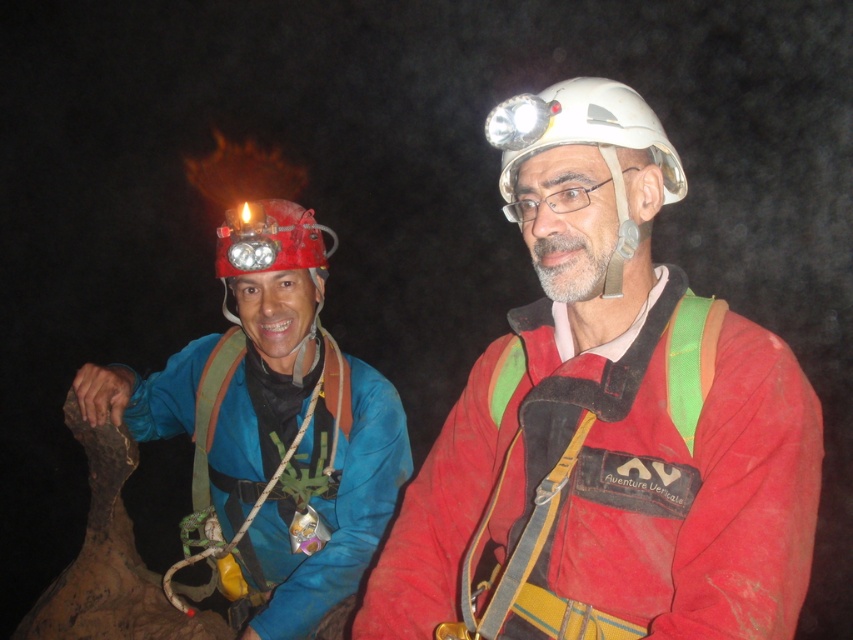
Question: Is matte red jacket at center below matte blue jacket at left?

Choices:
 (A) yes
 (B) no

Answer: (B)

Question: Does matte red jacket at center appear on the right side of matte blue jacket at left?

Choices:
 (A) yes
 (B) no

Answer: (A)

Question: Is matte red jacket at center smaller than matte blue jacket at left?

Choices:
 (A) no
 (B) yes

Answer: (B)